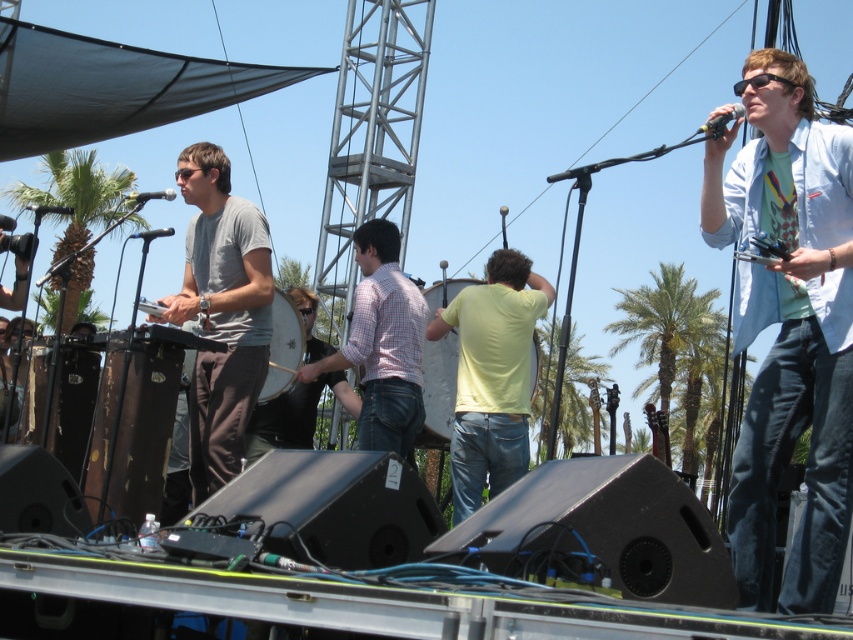
Looking at this image, you are a stagehand preparing to set up equipment for a performance. You have a wooden drum at center and a black matte microphone at center. Which object should you adjust first if you need to ensure that the smaller item is placed closer to the audience?

The wooden drum at center is smaller than the black matte microphone at center, so you should adjust the wooden drum at center first to place it closer to the audience.

You are a stagehand setting up a new microphone stand. You need to place it between the green leafy palm tree at center and the wooden drum at center. Which side of the microphone stand should face the wider object?

The green leafy palm tree at center might be wider than the wooden drum at center, so the microphone stand should face the palm tree to accommodate its width.